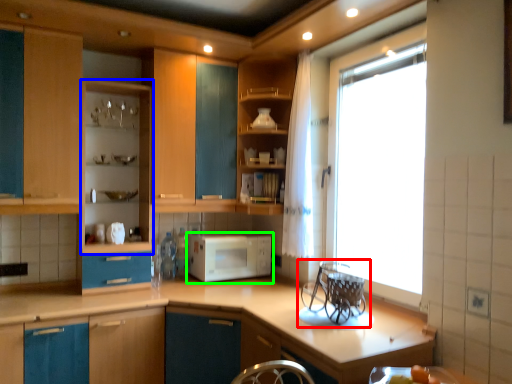
Question: Which is nearer to the appliance (highlighted by a red box)? cabinetry (highlighted by a blue box) or microwave oven (highlighted by a green box).

Choices:
 (A) cabinetry
 (B) microwave oven

Answer: (B)